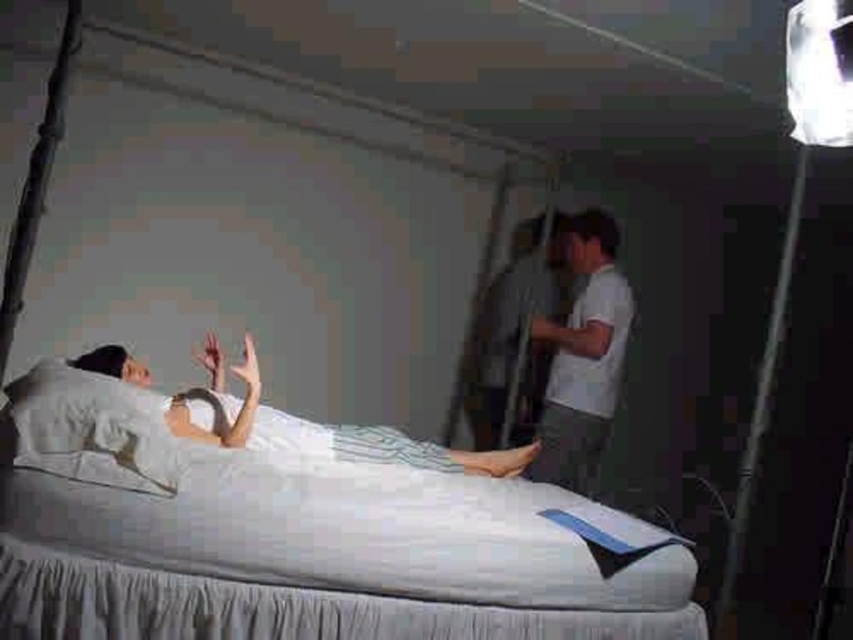
You are standing at the entrance of the room and want to place a small decorative item on the white soft pillow at left. Where exactly should you place it?

The white soft pillow at left is located at point (91, 428), so you should place the item at those coordinates.

You are organizing a charity event and need to determine which item takes up more space between the white fabric bed at center and the white cotton shirt at right. Which one would require more storage space?

The white fabric bed at center is larger in size than the white cotton shirt at right, so it would require more storage space.